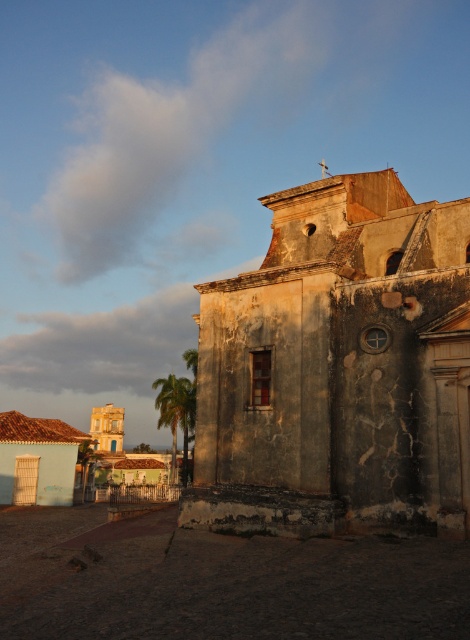
Question: Can you confirm if cracked stone church at center is smaller than green leafy palm tree at lower left?

Choices:
 (A) yes
 (B) no

Answer: (A)

Question: Which point appears farthest from the camera in this image?

Choices:
 (A) (194, 499)
 (B) (172, 390)

Answer: (B)

Question: Is cracked stone church at center positioned in front of green leafy palm tree at lower left?

Choices:
 (A) yes
 (B) no

Answer: (A)

Question: Can you confirm if cracked stone church at center is wider than green leafy palm tree at lower left?

Choices:
 (A) yes
 (B) no

Answer: (B)

Question: Which object appears farthest from the camera in this image?

Choices:
 (A) green leafy palm tree at lower left
 (B) cracked stone church at center

Answer: (A)